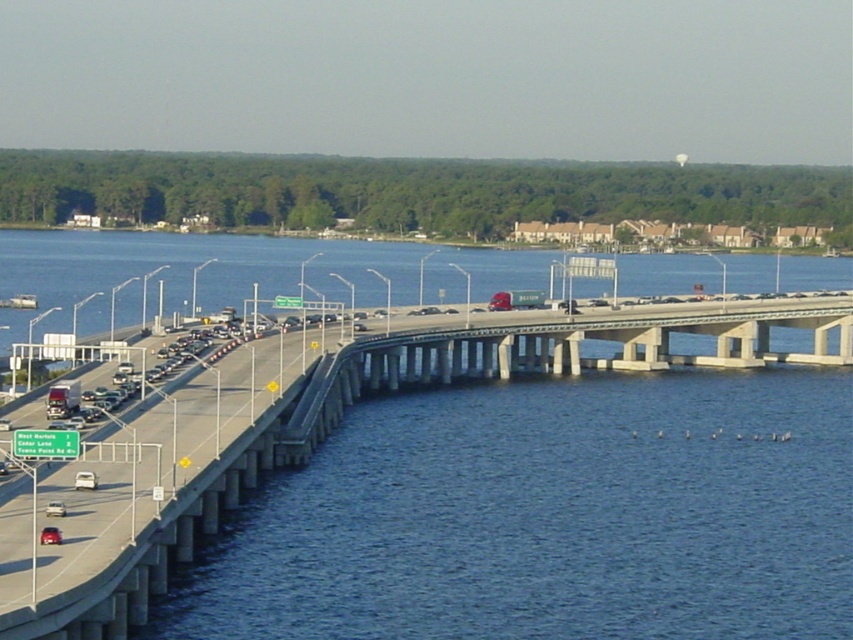
Is concrete bridge at center positioned before silver metallic sedan at center?

That is False.

What do you see at coordinates (543, 358) in the screenshot?
I see `concrete bridge at center` at bounding box center [543, 358].

This screenshot has height=640, width=853. I want to click on concrete bridge at center, so click(x=543, y=358).

Where is `concrete bridge at center`? The width and height of the screenshot is (853, 640). concrete bridge at center is located at coordinates (543, 358).

Who is lower down, concrete bridge at center or shiny red car at lower left?

shiny red car at lower left is lower down.

Is point (675, 355) less distant than point (50, 532)?

No, it is behind (50, 532).

This screenshot has height=640, width=853. I want to click on concrete bridge at center, so click(543, 358).

The width and height of the screenshot is (853, 640). What are the coordinates of `concrete bridge at center` in the screenshot? It's located at (543, 358).

Which is behind, point (47, 540) or point (64, 513)?

The point (64, 513) is behind.

Is shiny red car at lower left taller than silver metallic sedan at lower left?

Yes.

Identify the location of shiny red car at lower left. (50, 536).